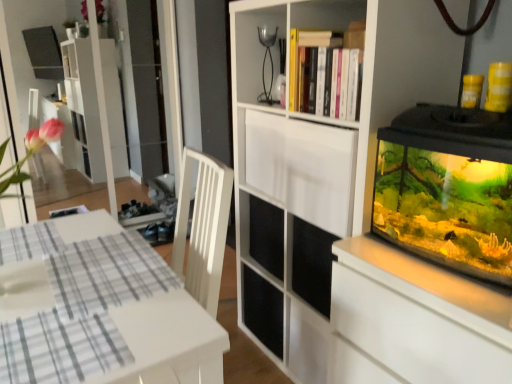
Question: Does white matte cupboard at center come in front of white glossy table at lower left?

Choices:
 (A) no
 (B) yes

Answer: (A)

Question: Does white matte cupboard at center have a lesser height compared to white glossy table at lower left?

Choices:
 (A) yes
 (B) no

Answer: (B)

Question: Is white matte cupboard at center positioned beyond the bounds of white glossy table at lower left?

Choices:
 (A) no
 (B) yes

Answer: (B)

Question: Is white matte cupboard at center with white glossy table at lower left?

Choices:
 (A) yes
 (B) no

Answer: (B)

Question: From a real-world perspective, is white matte cupboard at center below white glossy table at lower left?

Choices:
 (A) yes
 (B) no

Answer: (B)

Question: Is white matte cupboard at center wider or thinner than white glossy table at lower left?

Choices:
 (A) wide
 (B) thin

Answer: (B)

Question: From the image's perspective, is white matte cupboard at center positioned above or below white glossy table at lower left?

Choices:
 (A) above
 (B) below

Answer: (A)

Question: From a real-world perspective, relative to white glossy table at lower left, is white matte cupboard at center vertically above or below?

Choices:
 (A) below
 (B) above

Answer: (B)

Question: Considering the positions of point (259, 6) and point (24, 279), is point (259, 6) closer or farther from the camera than point (24, 279)?

Choices:
 (A) closer
 (B) farther

Answer: (B)

Question: Considering the relative positions of white glossy table at lower left and white matte cabinet at upper center in the image provided, is white glossy table at lower left to the left or to the right of white matte cabinet at upper center?

Choices:
 (A) right
 (B) left

Answer: (B)

Question: In terms of size, does white glossy table at lower left appear bigger or smaller than white matte cabinet at upper center?

Choices:
 (A) small
 (B) big

Answer: (B)

Question: Is white glossy table at lower left in front of or behind white matte cabinet at upper center in the image?

Choices:
 (A) behind
 (B) front

Answer: (B)

Question: Considering the positions of white glossy table at lower left and white matte cabinet at upper center in the image, is white glossy table at lower left taller or shorter than white matte cabinet at upper center?

Choices:
 (A) tall
 (B) short

Answer: (A)

Question: In terms of size, does white matte cabinet at upper center appear bigger or smaller than white matte cupboard at center?

Choices:
 (A) small
 (B) big

Answer: (A)

Question: From a real-world perspective, is white matte cabinet at upper center above or below white matte cupboard at center?

Choices:
 (A) above
 (B) below

Answer: (A)